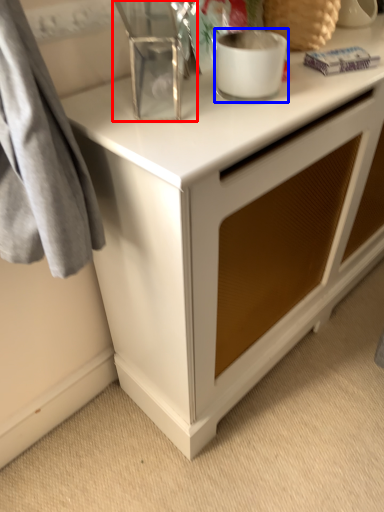
Question: Which object is further to the camera taking this photo, appliance (highlighted by a red box) or appliance (highlighted by a blue box)?

Choices:
 (A) appliance
 (B) appliance

Answer: (B)